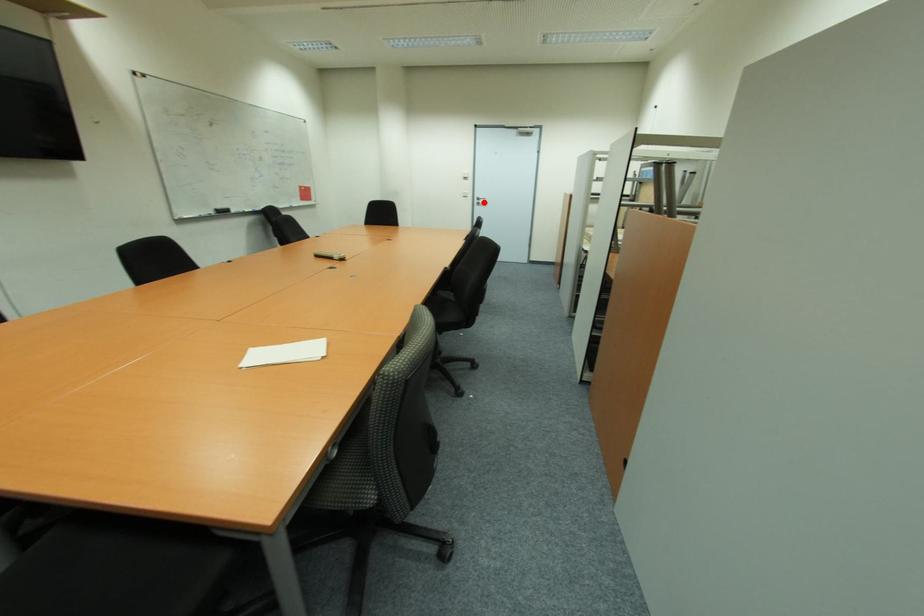
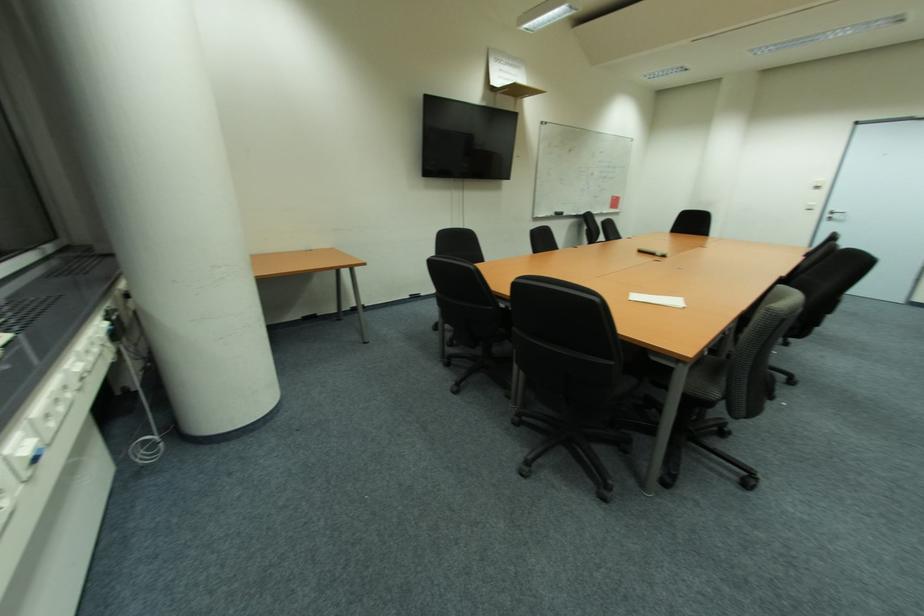
Question: I am providing you with two images of the same scene from different viewpoints. A red point is marked on the first image. At the location where the point appears in image 1, is it still visible in image 2?

Choices:
 (A) Yes
 (B) No

Answer: (A)